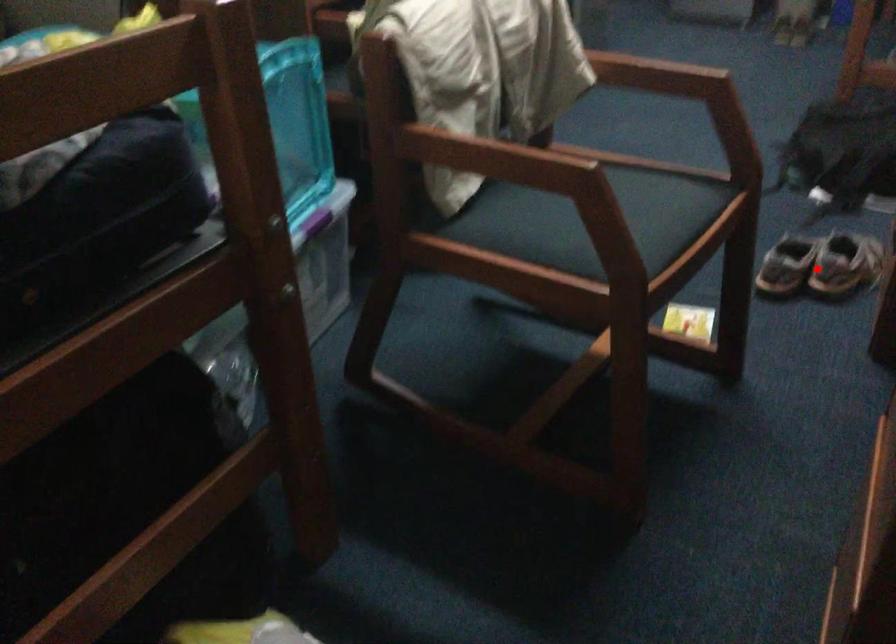
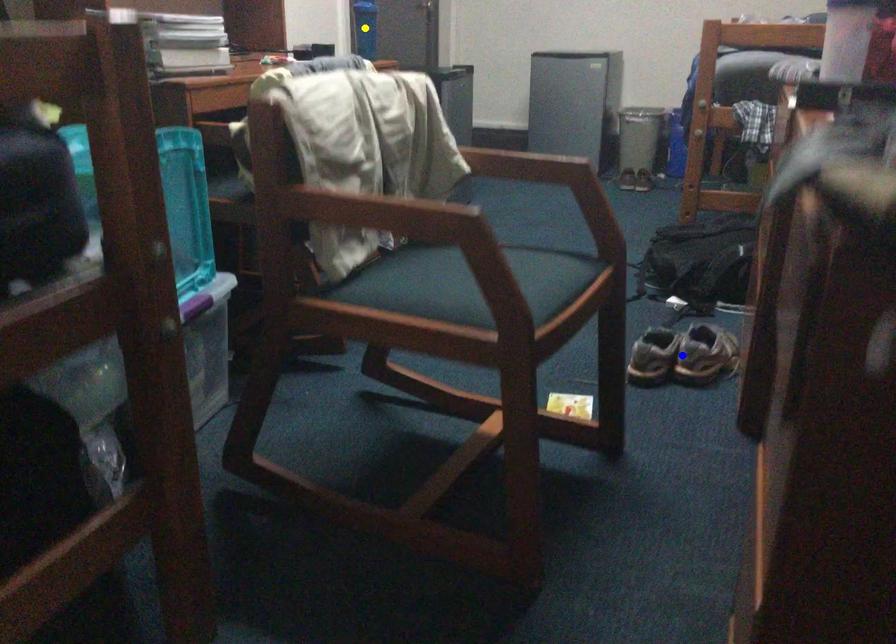
Question: I am providing you with two images of the same scene from different viewpoints. A red point is marked on the first image. You are given multiple points on the second image. Which point in image 2 is actually the same real-world point as the red point in image 1?

Choices:
 (A) yellow point
 (B) green point
 (C) blue point

Answer: (C)